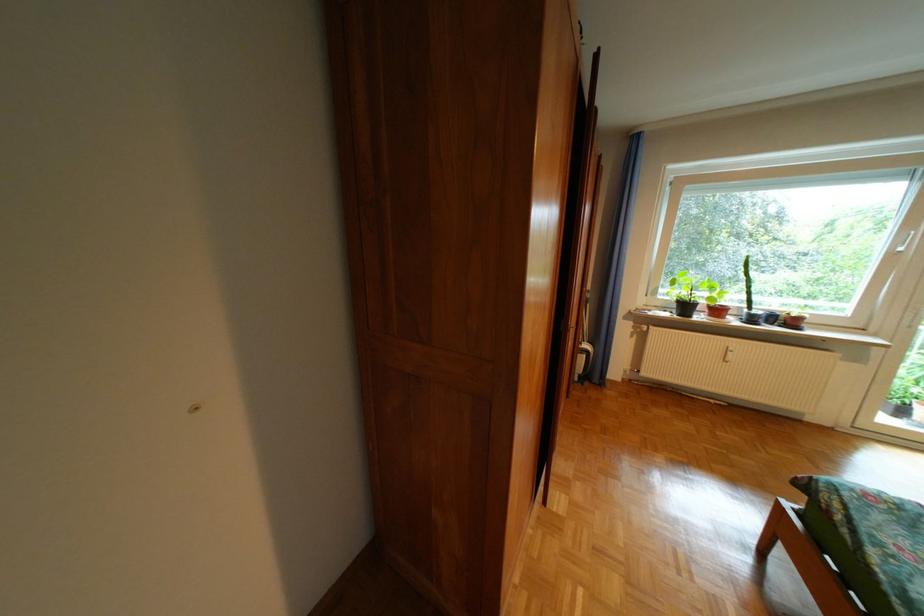
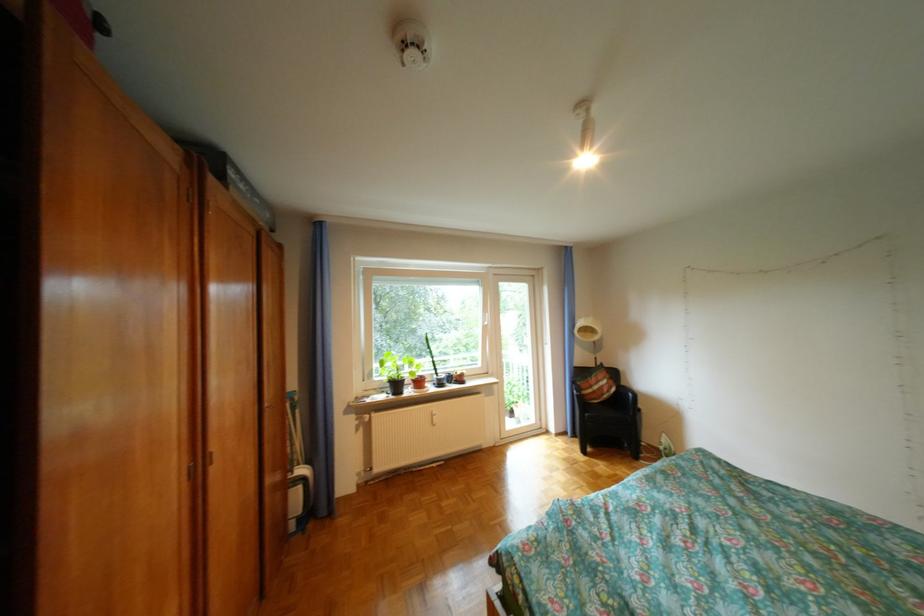
Question: The camera is either moving clockwise (left) or counter-clockwise (right) around the object. The first image is from the beginning of the video and the second image is from the end. Is the camera moving left or right when shooting the video?

Choices:
 (A) Left
 (B) Right

Answer: (A)